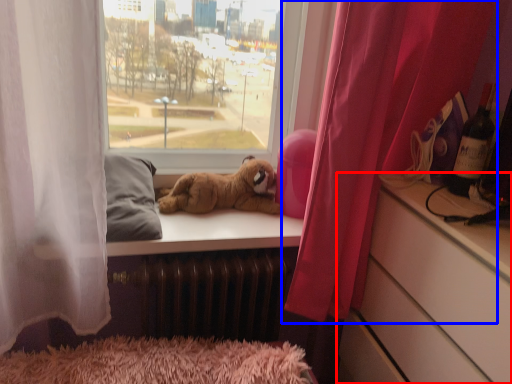
Question: Which object is further to the camera taking this photo, cabinetry (highlighted by a red box) or curtain (highlighted by a blue box)?

Choices:
 (A) cabinetry
 (B) curtain

Answer: (B)